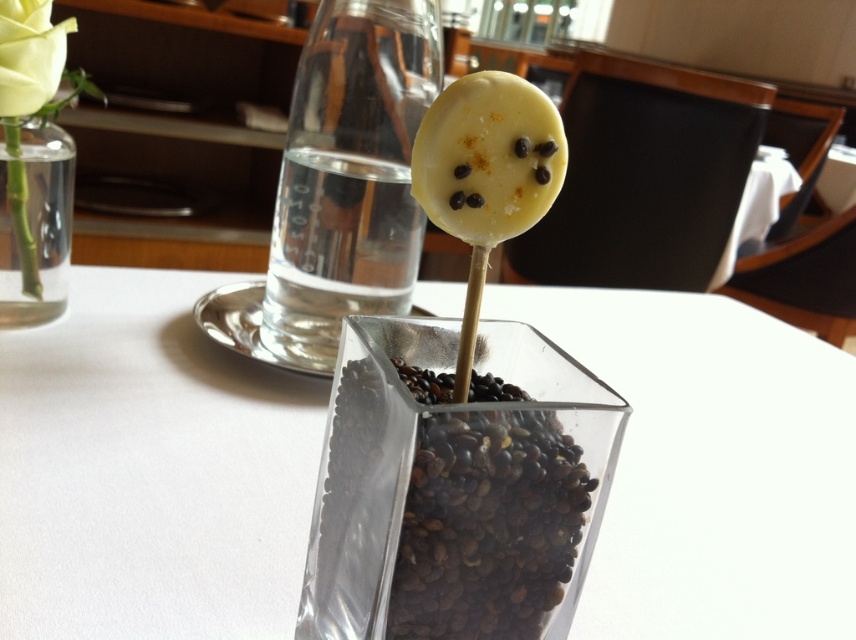
You are a customer at a cafe table. You want to place your phone between the transparent glass vase at center and the matte yellow rose at upper left. The phone is 6 inches long. Is there enough space?

The distance between the transparent glass vase at center and the matte yellow rose at upper left is 11.46 inches. Since the phone is 6 inches long, there is enough space to place it between them.

You are a customer at a cafe and want to place your phone on the table without blocking the transparent glass vase at center or the matte yellow rose at upper left. Which object should you avoid placing your phone near to ensure there is enough space?

You should avoid placing your phone near the transparent glass vase at center because it is wider than the matte yellow rose at upper left, so it requires more space.

You are a server in a restaurant and need to place a new menu on the table. The menu requires a space of 15x15 cm. Can you place it on the table without overlapping any existing items? Consider the transparent glass vase at center and other objects mentioned.

The transparent glass vase at center is located at point [149,472]. Since the menu requires 15x15 cm and the vase is at that coordinate, you need to check if there is enough space elsewhere on the table. However, without knowing the exact positions of other items like the bottle on the metallic tray or the vase with the yellow rose, it is uncertain if sufficient space exists. Please ensure the menu does not overlap any items by placing it in an open area away from the vase and other objects.